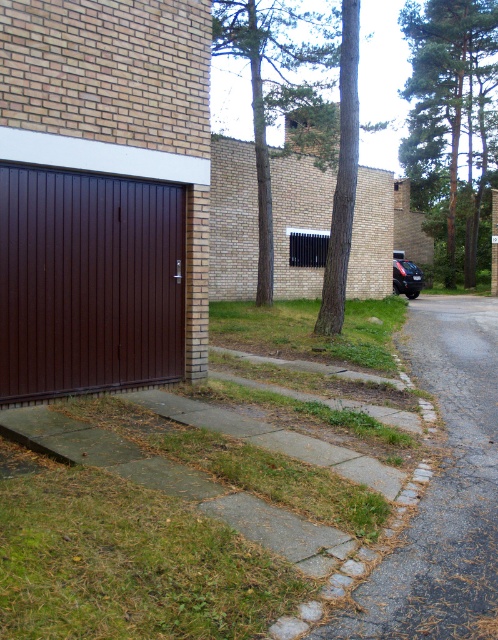
Question: Which object is closer to the camera taking this photo?

Choices:
 (A) glossy black car at lower right
 (B) gray asphalt driveway at lower right

Answer: (B)

Question: Can you confirm if green textured tree at center is positioned to the left of glossy black car at lower right?

Choices:
 (A) yes
 (B) no

Answer: (A)

Question: Is gray asphalt driveway at lower right thinner than glossy black car at lower right?

Choices:
 (A) yes
 (B) no

Answer: (B)

Question: Which point appears closest to the camera in this image?

Choices:
 (A) (406, 276)
 (B) (292, 16)
 (C) (336, 228)

Answer: (C)

Question: Is green leafy tree at upper center closer to camera compared to glossy black car at lower right?

Choices:
 (A) yes
 (B) no

Answer: (A)

Question: Which point is closer to the camera?

Choices:
 (A) green textured tree at center
 (B) brown matte/glossy garage door at lower left
 (C) green leafy tree at upper right
 (D) glossy black car at lower right

Answer: (B)